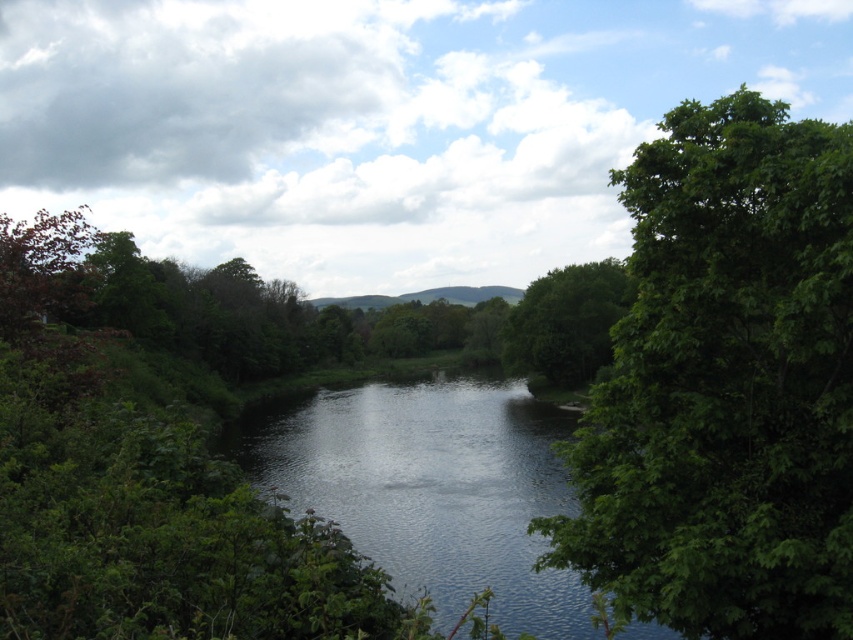
Question: Which of the following is the farthest from the observer?

Choices:
 (A) green leafy tree at right
 (B) green leafy tree at center

Answer: (B)

Question: Which of the following is the closest to the observer?

Choices:
 (A) (676, 356)
 (B) (532, 289)

Answer: (A)

Question: Is the position of green leafy tree at right less distant than that of green leafy tree at center?

Choices:
 (A) yes
 (B) no

Answer: (A)

Question: Does green leafy tree at right have a smaller size compared to green leafy tree at center?

Choices:
 (A) yes
 (B) no

Answer: (B)

Question: Does green leafy tree at right appear on the right side of green leafy tree at center?

Choices:
 (A) no
 (B) yes

Answer: (A)

Question: Which of the following is the closest to the observer?

Choices:
 (A) (779, 428)
 (B) (625, 273)

Answer: (A)